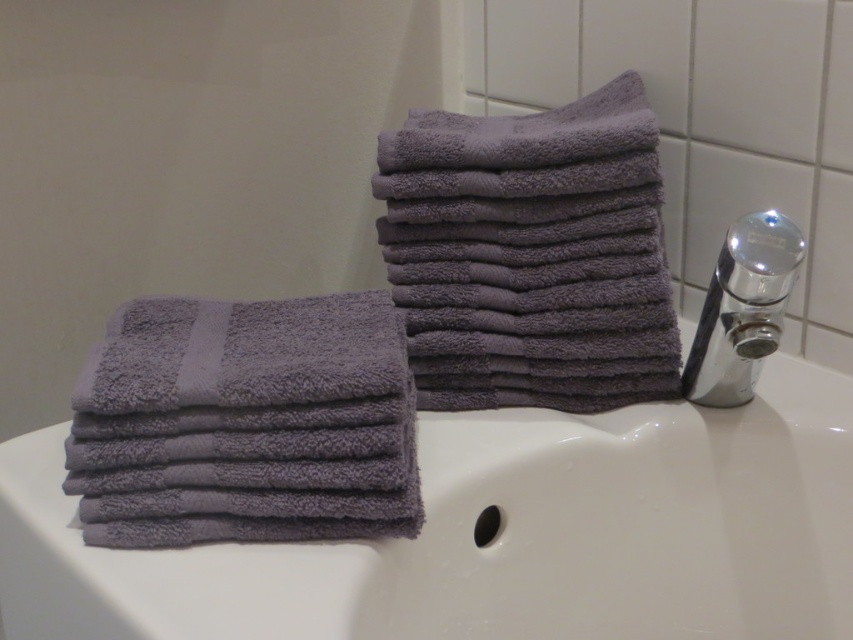
Who is lower down, purple terry cloth towel at left or chrome metallic faucet at upper right?

Positioned lower is purple terry cloth towel at left.

Is purple terry cloth towel at left to the left of chrome metallic faucet at upper right from the viewer's perspective?

Yes, purple terry cloth towel at left is to the left of chrome metallic faucet at upper right.

Does point (109, 435) come in front of point (692, 369)?

That is True.

Where is `purple terry cloth towel at left`? This screenshot has width=853, height=640. purple terry cloth towel at left is located at coordinates (247, 422).

Who is shorter, purple terry cloth towels at upper right or purple terry cloth towel at left?

purple terry cloth towel at left is shorter.

Image resolution: width=853 pixels, height=640 pixels. Describe the element at coordinates (531, 253) in the screenshot. I see `purple terry cloth towels at upper right` at that location.

What are the coordinates of `purple terry cloth towels at upper right` in the screenshot? It's located at (531, 253).

Is purple terry cloth towels at upper right taller than chrome metallic faucet at upper right?

Yes, purple terry cloth towels at upper right is taller than chrome metallic faucet at upper right.

Who is taller, purple terry cloth towels at upper right or chrome metallic faucet at upper right?

purple terry cloth towels at upper right is taller.

Which is in front, point (512, 355) or point (709, 289)?

Point (709, 289) is more forward.

The height and width of the screenshot is (640, 853). Identify the location of purple terry cloth towels at upper right. (531, 253).